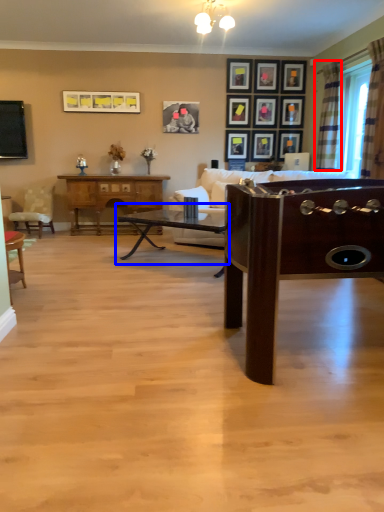
Question: Which of the following is the closest to the observer, curtain (highlighted by a red box) or coffee table (highlighted by a blue box)?

Choices:
 (A) curtain
 (B) coffee table

Answer: (B)